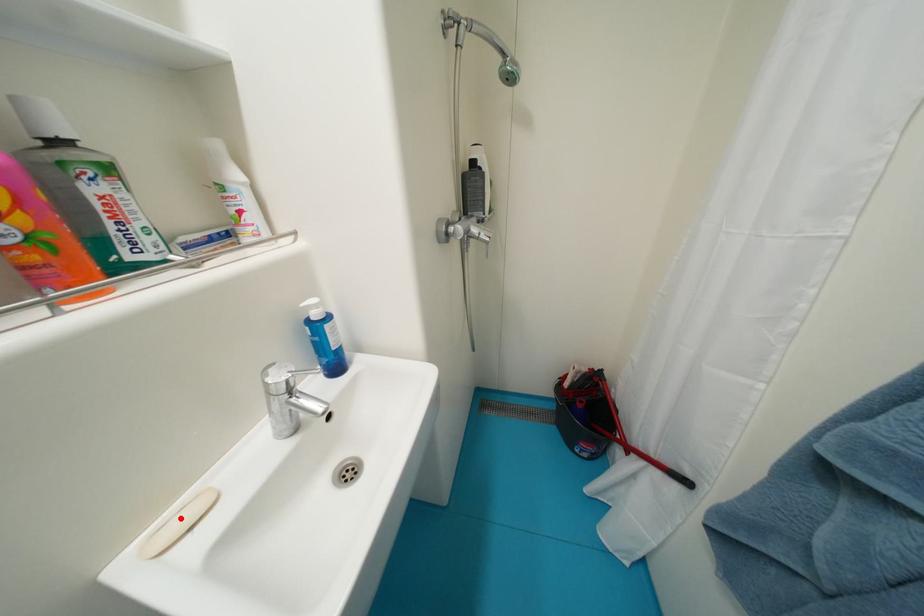
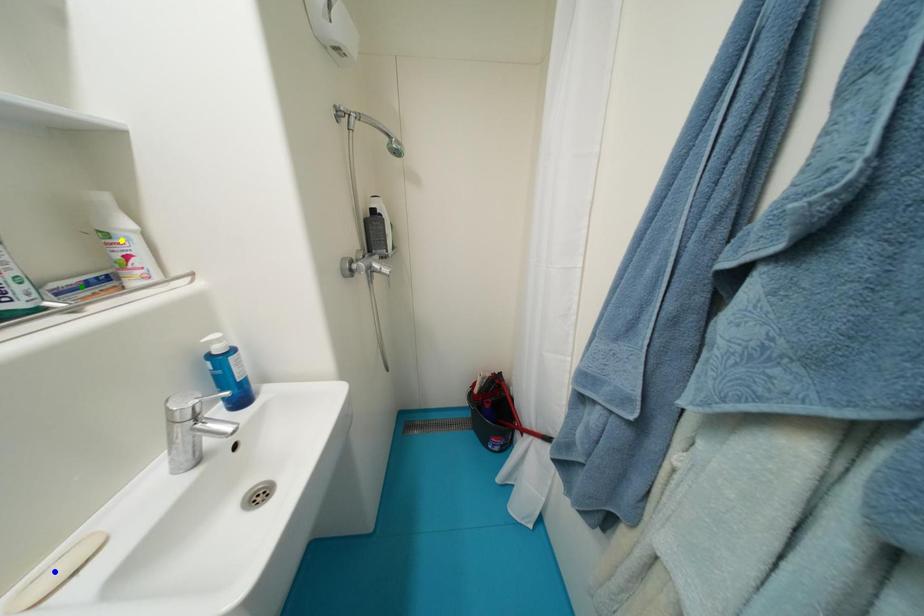
Question: I am providing you with two images of the same scene from different viewpoints. A red point is marked on the first image. You are given multiple points on the second image. Can you choose the point in image 2 that corresponds to the point in image 1?

Choices:
 (A) yellow point
 (B) green point
 (C) blue point

Answer: (C)